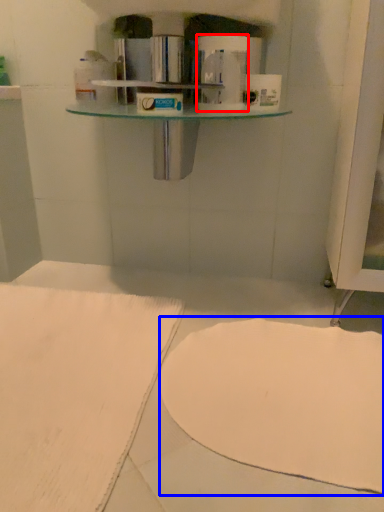
Question: Which of the following is the closest to the observer, toilet paper (highlighted by a red box) or wide (highlighted by a blue box)?

Choices:
 (A) toilet paper
 (B) wide

Answer: (B)